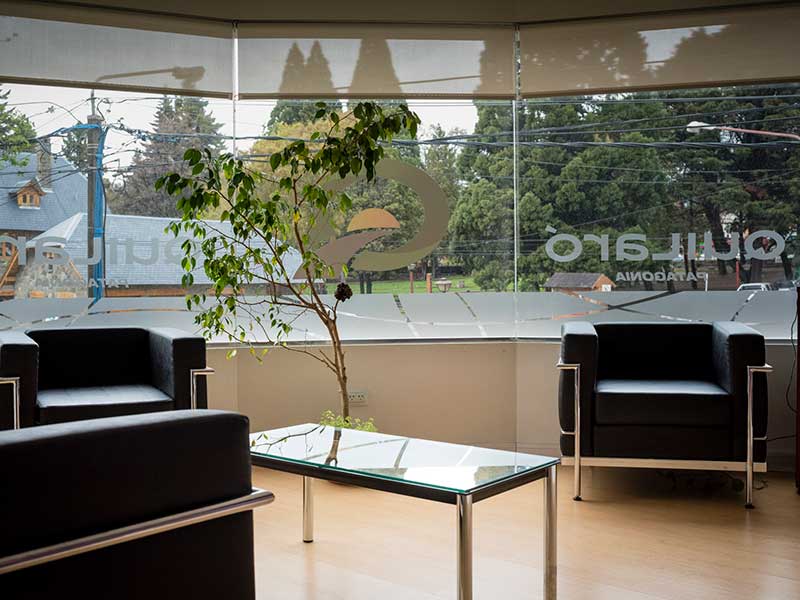
Identify the location of table. (406, 453).